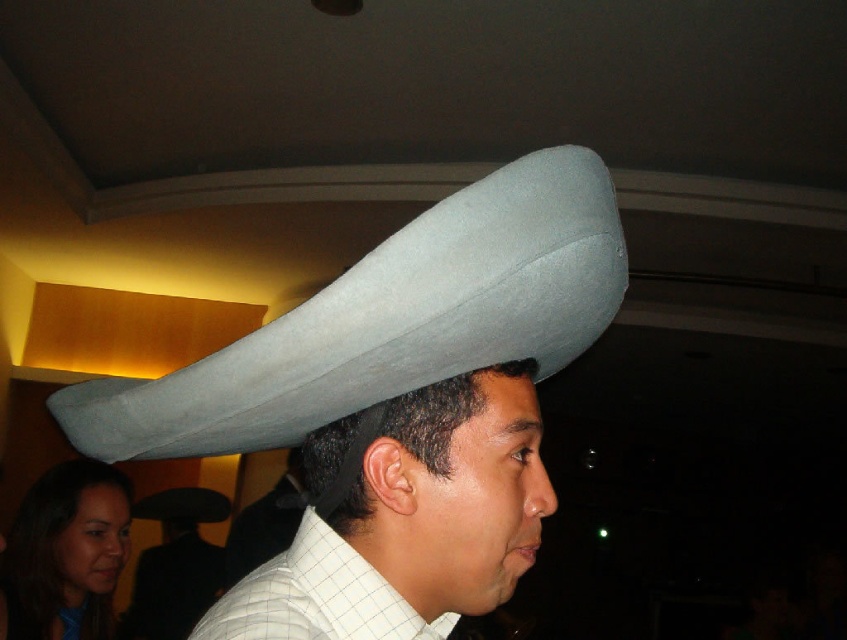
The height and width of the screenshot is (640, 847). What do you see at coordinates (316, 596) in the screenshot? I see `white checkered shirt at center` at bounding box center [316, 596].

Can you confirm if white checkered shirt at center is taller than gray felt hat at upper center?

No, white checkered shirt at center is not taller than gray felt hat at upper center.

Does point (325, 568) come closer to viewer compared to point (197, 518)?

Yes, it is in front of point (197, 518).

The height and width of the screenshot is (640, 847). I want to click on white checkered shirt at center, so click(x=316, y=596).

What do you see at coordinates (316, 596) in the screenshot? I see `white checkered shirt at center` at bounding box center [316, 596].

The height and width of the screenshot is (640, 847). I want to click on white checkered shirt at center, so click(x=316, y=596).

Is gray felt cowboy hat at upper center below white felt hat at upper center?

Actually, gray felt cowboy hat at upper center is above white felt hat at upper center.

Locate an element on the screen. gray felt cowboy hat at upper center is located at coordinates (390, 321).